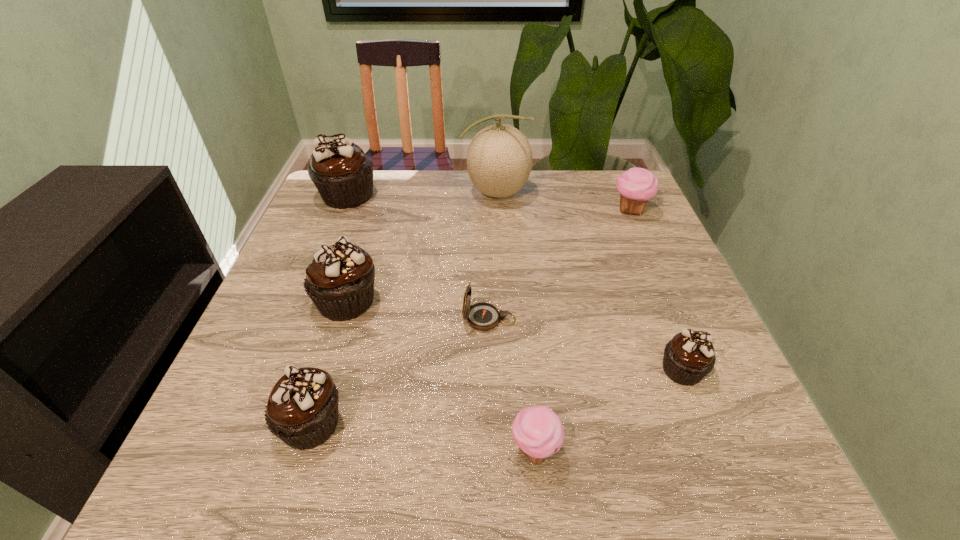
This screenshot has width=960, height=540. In order to click on free space that satisfies the following two spatial constraints: 1. on the front side of the sixth farthest object; 2. on the right side of the cantaloup in this screenshot , I will do `click(505, 370)`.

At what (x,y) coordinates should I click in order to perform the action: click on free space in the image that satisfies the following two spatial constraints: 1. on the front side of the third biggest brown cupcake; 2. on the left side of the fourth cupcake from left to right. Please return your answer as a coordinate pair (x, y). Looking at the image, I should click on (303, 449).

You are a GUI agent. You are given a task and a screenshot of the screen. Output one action in this format:
    pyautogui.click(x=<x>, y=<y>)
    Task: Click on the free spot that satisfies the following two spatial constraints: 1. on the face of the compass; 2. on the back side of the rightmost brown cupcake
    The width and height of the screenshot is (960, 540).
    Given the screenshot: What is the action you would take?
    pyautogui.click(x=490, y=370)

Locate an element on the screen. free location that satisfies the following two spatial constraints: 1. on the back side of the third biggest brown cupcake; 2. on the right side of the farther pink cupcake is located at coordinates (375, 210).